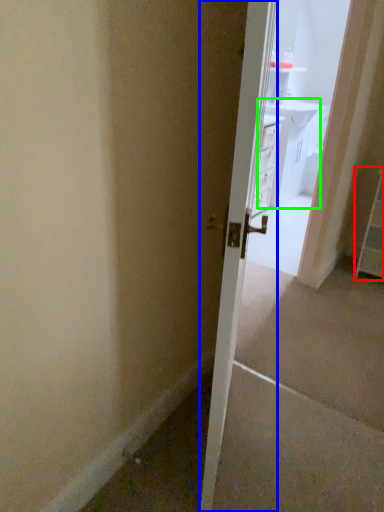
Question: Estimate the real-world distances between objects in this image. Which object is closer to dresser (highlighted by a red box), door (highlighted by a blue box) or vanity (highlighted by a green box)?

Choices:
 (A) door
 (B) vanity

Answer: (A)